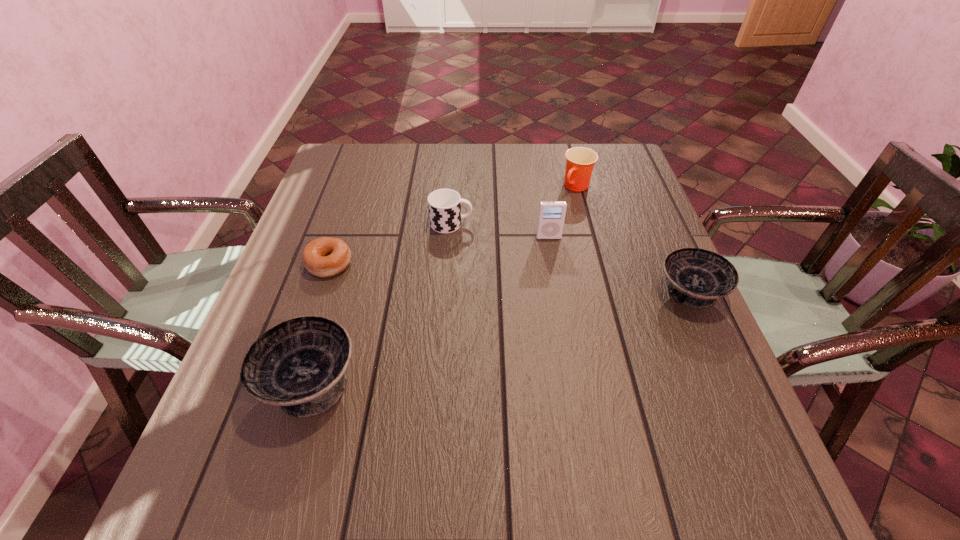
Locate an element on the screen. bagel at the left edge is located at coordinates (323, 257).

You are a GUI agent. You are given a task and a screenshot of the screen. Output one action in this format:
    pyautogui.click(x=<x>, y=<y>)
    Task: Click on the bowl that is at the right edge
    This screenshot has width=960, height=540.
    Given the screenshot: What is the action you would take?
    pyautogui.click(x=697, y=277)

Where is `cup located in the right edge section of the desktop`? cup located in the right edge section of the desktop is located at coordinates (580, 161).

Where is `object located at the near left corner`? object located at the near left corner is located at coordinates (299, 364).

Where is `object located in the far right corner section of the desktop`? This screenshot has height=540, width=960. object located in the far right corner section of the desktop is located at coordinates (580, 161).

This screenshot has width=960, height=540. I want to click on vacant space at the far edge of the desktop, so click(446, 144).

You are a GUI agent. You are given a task and a screenshot of the screen. Output one action in this format:
    pyautogui.click(x=<x>, y=<y>)
    Task: Click on the vacant space at the near edge
    
    Given the screenshot: What is the action you would take?
    pyautogui.click(x=436, y=415)

At what (x,y) coordinates should I click in order to perform the action: click on free point at the left edge. Please return your answer as a coordinate pair (x, y). Looking at the image, I should click on (356, 255).

In the image, there is a desktop. Where is `vacant space at the right edge`? This screenshot has width=960, height=540. vacant space at the right edge is located at coordinates (632, 282).

The width and height of the screenshot is (960, 540). In the image, there is a desktop. In order to click on free region at the near left corner in this screenshot , I will do `click(231, 402)`.